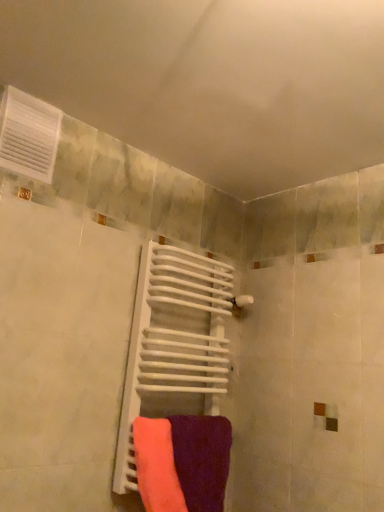
Find the location of a particular element. Image resolution: width=384 pixels, height=512 pixels. white plastic vent at upper left is located at coordinates (28, 135).

What is the approximate height of purple matte towel at center, the 2th towel when ordered from left to right?

purple matte towel at center, the 2th towel when ordered from left to right, is 30.65 centimeters in height.

How much space does neon pink fabric at center, which ranks as the 1th towel in left-to-right order, occupy vertically?

36.81 centimeters.

The width and height of the screenshot is (384, 512). Find the location of `white plastic vent at upper left`. white plastic vent at upper left is located at coordinates (28, 135).

How different are the orientations of white matte radiator at center and neon pink fabric at center, which ranks as the 1th towel in left-to-right order, in degrees?

The angular difference between white matte radiator at center and neon pink fabric at center, which ranks as the 1th towel in left-to-right order, is 14.9 degrees.

Considering the positions of point (170, 247) and point (172, 490), is point (170, 247) closer or farther from the camera than point (172, 490)?

Point (170, 247) is positioned farther from the camera compared to point (172, 490).

From the image's perspective, relative to neon pink fabric at center, which ranks as the 2th towel in right-to-left order, is white matte radiator at center above or below?

Clearly, from the image's perspective, white matte radiator at center is above neon pink fabric at center, which ranks as the 2th towel in right-to-left order.

From the picture: Which is in front, white matte radiator at center or neon pink fabric at center, which ranks as the 1th towel in left-to-right order?

neon pink fabric at center, which ranks as the 1th towel in left-to-right order, is more forward.

Is purple matte towel at center, the first towel when ordered from right to left, facing away from white matte radiator at center?

Absolutely, purple matte towel at center, the first towel when ordered from right to left, is directed away from white matte radiator at center.

Identify the location of radiator located on the left of purple matte towel at center, the first towel when ordered from right to left. The width and height of the screenshot is (384, 512). (173, 344).

Is purple matte towel at center, the 2th towel when ordered from left to right, bigger than white matte radiator at center?

No.

Between white plastic vent at upper left and neon pink fabric at center, which ranks as the 1th towel in left-to-right order, which one has smaller width?

white plastic vent at upper left.

Between point (38, 170) and point (137, 479), which one is positioned in front?

The point (38, 170) is more forward.

In the scene shown: Considering the sizes of white plastic vent at upper left and neon pink fabric at center, which ranks as the 1th towel in left-to-right order, in the image, is white plastic vent at upper left taller or shorter than neon pink fabric at center, which ranks as the 1th towel in left-to-right order,?

white plastic vent at upper left is shorter than neon pink fabric at center, which ranks as the 1th towel in left-to-right order.

In the scene shown: Is white plastic vent at upper left further to camera compared to neon pink fabric at center, which ranks as the 2th towel in right-to-left order?

Yes.

Is neon pink fabric at center, which ranks as the 2th towel in right-to-left order, positioned before white matte radiator at center?

Yes, neon pink fabric at center, which ranks as the 2th towel in right-to-left order, is closer to the camera.

Which is in front, point (163, 466) or point (214, 355)?

The point (163, 466) is in front.

Is there a large distance between neon pink fabric at center, which ranks as the 1th towel in left-to-right order, and white matte radiator at center?

No, neon pink fabric at center, which ranks as the 1th towel in left-to-right order, is not far from white matte radiator at center.

From the picture: Can we say neon pink fabric at center, which ranks as the 2th towel in right-to-left order, lies outside white matte radiator at center?

That's correct, neon pink fabric at center, which ranks as the 2th towel in right-to-left order, is outside of white matte radiator at center.

What's the angular difference between white matte radiator at center and purple matte towel at center, the 2th towel when ordered from left to right,'s facing directions?

They differ by 14.9 degrees in their facing directions.

Does white matte radiator at center turn towards purple matte towel at center, the first towel when ordered from right to left?

Yes, white matte radiator at center faces towards purple matte towel at center, the first towel when ordered from right to left.

Considering the relative sizes of white matte radiator at center and purple matte towel at center, the 2th towel when ordered from left to right, in the image provided, is white matte radiator at center thinner than purple matte towel at center, the 2th towel when ordered from left to right,?

In fact, white matte radiator at center might be wider than purple matte towel at center, the 2th towel when ordered from left to right.

From a real-world perspective, does white matte radiator at center sit lower than purple matte towel at center, the first towel when ordered from right to left?

Actually, white matte radiator at center is physically above purple matte towel at center, the first towel when ordered from right to left, in the real world.

Considering the relative positions of purple matte towel at center, the 2th towel when ordered from left to right, and white plastic vent at upper left in the image provided, is purple matte towel at center, the 2th towel when ordered from left to right, to the left of white plastic vent at upper left from the viewer's perspective?

No.

From a real-world perspective, is purple matte towel at center, the first towel when ordered from right to left, under white plastic vent at upper left?

Correct, in the physical world, purple matte towel at center, the first towel when ordered from right to left, is lower than white plastic vent at upper left.

From the image's perspective, which object appears higher, purple matte towel at center, the first towel when ordered from right to left, or white plastic vent at upper left?

white plastic vent at upper left appears higher in the image.

Is white matte radiator at center facing towards white plastic vent at upper left?

No.

Can you confirm if white matte radiator at center is taller than white plastic vent at upper left?

Indeed, white matte radiator at center has a greater height compared to white plastic vent at upper left.

Is white matte radiator at center in front of white plastic vent at upper left?

No, it is not.

From a real-world perspective, which is physically below, white matte radiator at center or white plastic vent at upper left?

In real-world perspective, white matte radiator at center is lower.

Which towel is the 2nd one when counting from the front of the white matte radiator at center? Please provide its 2D coordinates.

[(156, 466)]

In order to click on radiator on the left of purple matte towel at center, the first towel when ordered from right to left in this screenshot , I will do coord(173,344).

Based on their spatial positions, is white plastic vent at upper left or neon pink fabric at center, which ranks as the 2th towel in right-to-left order, closer to purple matte towel at center, the 2th towel when ordered from left to right?

neon pink fabric at center, which ranks as the 2th towel in right-to-left order, is positioned closer to the anchor purple matte towel at center, the 2th towel when ordered from left to right.

Which object lies nearer to the anchor point white matte radiator at center, white plastic vent at upper left or neon pink fabric at center, which ranks as the 2th towel in right-to-left order?

Among the two, neon pink fabric at center, which ranks as the 2th towel in right-to-left order, is located nearer to white matte radiator at center.

Which object lies further to the anchor point white matte radiator at center, purple matte towel at center, the 2th towel when ordered from left to right, or white plastic vent at upper left?

white plastic vent at upper left is positioned further to the anchor white matte radiator at center.

Looking at the image, which one is located closer to white matte radiator at center, purple matte towel at center, the 2th towel when ordered from left to right, or neon pink fabric at center, which ranks as the 1th towel in left-to-right order?

purple matte towel at center, the 2th towel when ordered from left to right, is closer to white matte radiator at center.

Looking at the image, which one is located closer to white matte radiator at center, neon pink fabric at center, which ranks as the 1th towel in left-to-right order, or white plastic vent at upper left?

Based on the image, neon pink fabric at center, which ranks as the 1th towel in left-to-right order, appears to be nearer to white matte radiator at center.

Considering their positions, is purple matte towel at center, the 2th towel when ordered from left to right, positioned closer to neon pink fabric at center, which ranks as the 1th towel in left-to-right order, than white plastic vent at upper left?

purple matte towel at center, the 2th towel when ordered from left to right.

From the image, which object appears to be nearer to white plastic vent at upper left, white matte radiator at center or neon pink fabric at center, which ranks as the 1th towel in left-to-right order?

white matte radiator at center is positioned closer to the anchor white plastic vent at upper left.

Estimate the real-world distances between objects in this image. Which object is closer to purple matte towel at center, the 2th towel when ordered from left to right, white matte radiator at center or white plastic vent at upper left?

The object closer to purple matte towel at center, the 2th towel when ordered from left to right, is white matte radiator at center.

Find the location of a particular element. The width and height of the screenshot is (384, 512). radiator that lies between white plastic vent at upper left and purple matte towel at center, the 2th towel when ordered from left to right, from top to bottom is located at coordinates (173, 344).

Find the location of a particular element. The width and height of the screenshot is (384, 512). towel between white plastic vent at upper left and neon pink fabric at center, which ranks as the 2th towel in right-to-left order, vertically is located at coordinates (202, 459).

Locate an element on the screen. The height and width of the screenshot is (512, 384). towel between white matte radiator at center and neon pink fabric at center, which ranks as the 1th towel in left-to-right order, vertically is located at coordinates (202, 459).

This screenshot has height=512, width=384. I want to click on radiator between white plastic vent at upper left and neon pink fabric at center, which ranks as the 2th towel in right-to-left order, in the up-down direction, so click(173, 344).